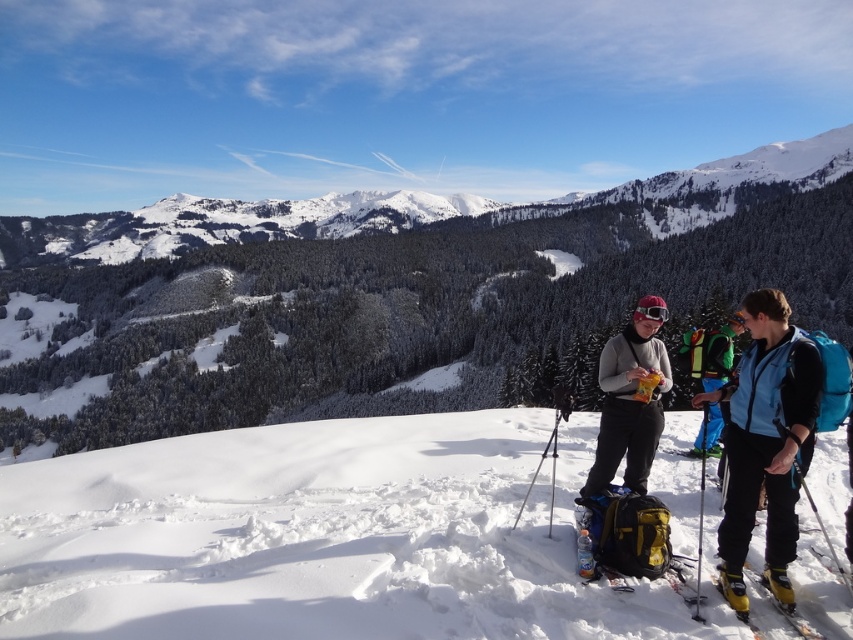
You are planning to set up a small tent between the white snow at center and the yellow fabric backpack at center. The tent requires a minimum of 25 feet of space between them. Is there enough space?

The distance between the white snow at center and the yellow fabric backpack at center is 30.03 feet, which is more than the required 25 feet. Therefore, there is enough space to set up the tent.

You are planning to set up a temporary shelter on the white snow at center. The yellow fabric backpack at center is in your way. Can you move the backpack to the side to make space for the shelter without needing to carry it far?

The white snow at center is larger in size than the yellow fabric backpack at center, so there is enough space to move the backpack to the side without needing to carry it far.